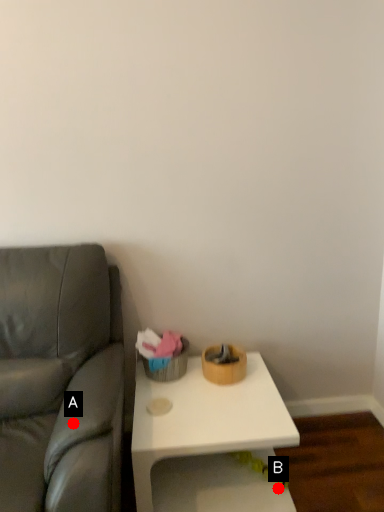
Question: Two points are circled on the image, labeled by A and B beside each circle. Which of the following is the closest to the observer?

Choices:
 (A) A is closer
 (B) B is closer

Answer: (A)